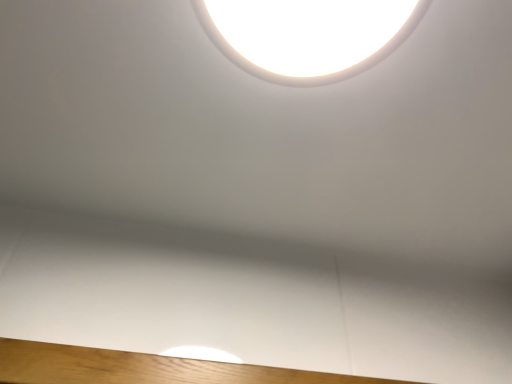
Describe the element at coordinates (308, 35) in the screenshot. I see `white glossy lamp at upper center` at that location.

Identify the location of white glossy lamp at upper center. (308, 35).

You are a GUI agent. You are given a task and a screenshot of the screen. Output one action in this format:
    pyautogui.click(x=<x>, y=<y>)
    Task: Click on the white glossy lamp at upper center
    
    Given the screenshot: What is the action you would take?
    pyautogui.click(x=308, y=35)